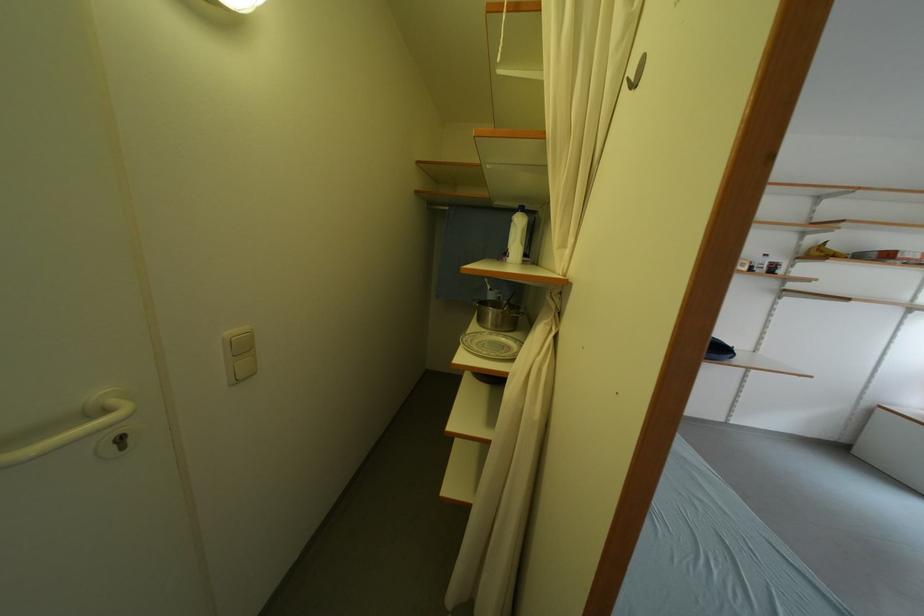
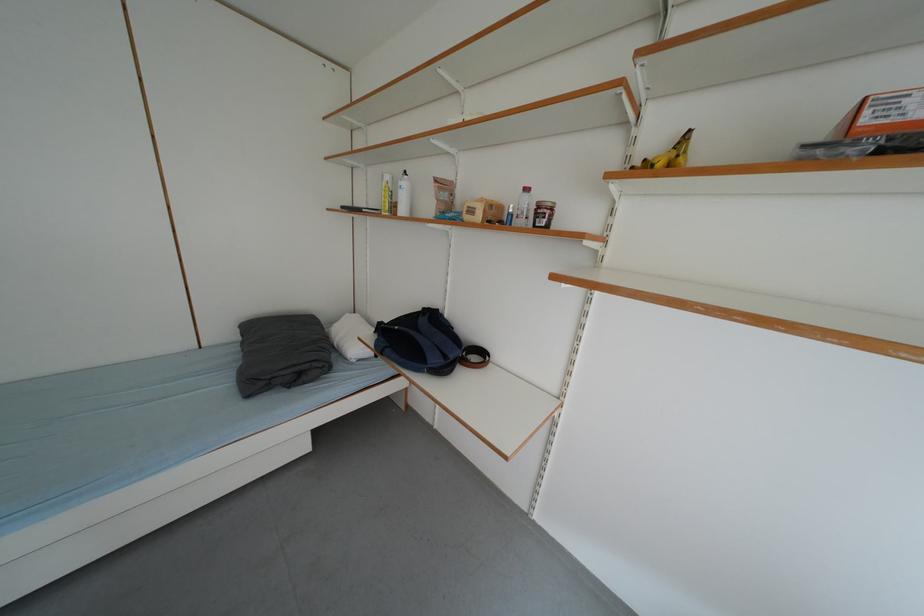
Where in the second image is the point corresponding to (x=755, y=272) from the first image?

(487, 220)